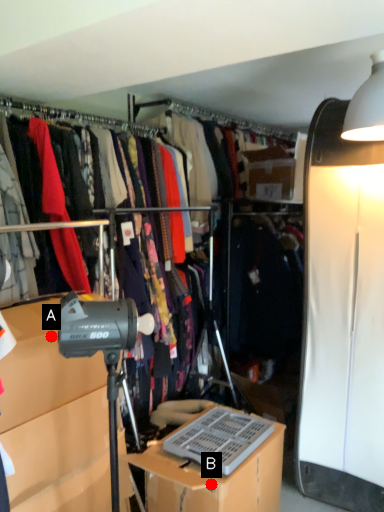
Question: Two points are circled on the image, labeled by A and B beside each circle. Which point is farther from the camera taking this photo?

Choices:
 (A) A is further
 (B) B is further

Answer: (B)